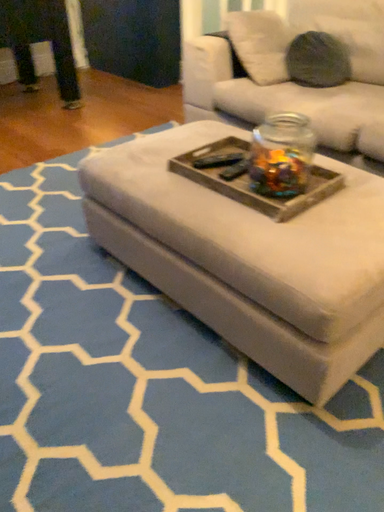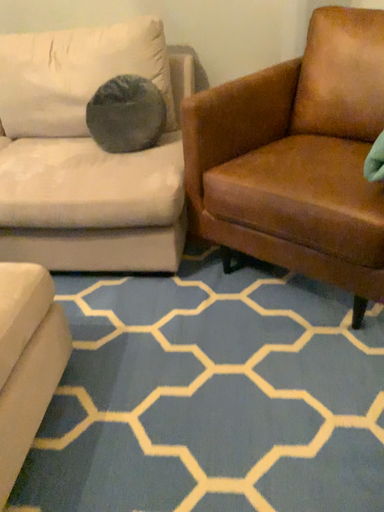
Question: How did the camera likely rotate when shooting the video?

Choices:
 (A) rotated downward
 (B) rotated upward

Answer: (B)